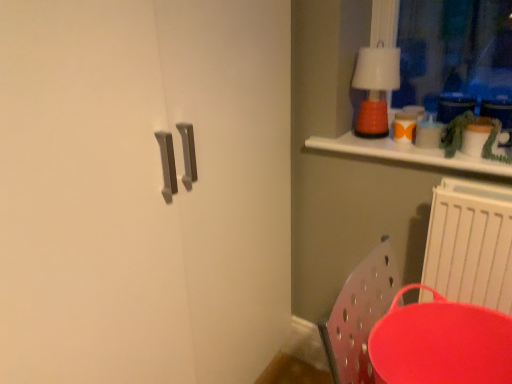
The height and width of the screenshot is (384, 512). Find the location of `matte red tray at lower right`. matte red tray at lower right is located at coordinates (441, 343).

The image size is (512, 384). What are the coordinates of `orange matte lamp at upper right` in the screenshot? It's located at (375, 88).

Image resolution: width=512 pixels, height=384 pixels. In order to click on white plastic radiator at lower right in this screenshot , I will do `click(470, 244)`.

Which of these two, white plastic radiator at lower right or matte red tray at lower right, is smaller?

white plastic radiator at lower right.

From a real-world perspective, is white plastic radiator at lower right located beneath matte red tray at lower right?

No, from a real-world perspective, white plastic radiator at lower right is not beneath matte red tray at lower right.

Is white plastic radiator at lower right placed right next to matte red tray at lower right?

No, white plastic radiator at lower right is not making contact with matte red tray at lower right.

From the image's perspective, is white plastic radiator at lower right located above matte red tray at lower right?

Yes, from the image's perspective, white plastic radiator at lower right is over matte red tray at lower right.

Which is closer, (430, 243) or (388, 51)?

The point (430, 243) is in front.

From the image's perspective, which object appears higher, white plastic radiator at lower right or orange matte lamp at upper right?

orange matte lamp at upper right, from the image's perspective.

Between white plastic radiator at lower right and orange matte lamp at upper right, which one appears on the right side from the viewer's perspective?

Positioned to the right is white plastic radiator at lower right.

From the picture: Is orange matte lamp at upper right looking in the opposite direction of white plastic radiator at lower right?

No.

Is orange matte lamp at upper right completely or partially outside of white plastic radiator at lower right?

Yes.

From their relative heights in the image, would you say orange matte lamp at upper right is taller or shorter than white plastic radiator at lower right?

In the image, orange matte lamp at upper right appears to be shorter than white plastic radiator at lower right.

The height and width of the screenshot is (384, 512). In order to click on lamp above the white plastic radiator at lower right (from a real-world perspective) in this screenshot , I will do `click(375, 88)`.

From the picture: Choose the correct answer: Is matte red tray at lower right inside white plastic radiator at lower right or outside it?

The correct answer is: outside.

From a real-world perspective, between matte red tray at lower right and white plastic radiator at lower right, who is vertically higher?

white plastic radiator at lower right is physically above.

Based on their positions, is matte red tray at lower right located to the left or right of white plastic radiator at lower right?

Clearly, matte red tray at lower right is on the left of white plastic radiator at lower right in the image.

Looking at this image, are matte red tray at lower right and white plastic radiator at lower right far apart?

matte red tray at lower right is near white plastic radiator at lower right, not far away.

The width and height of the screenshot is (512, 384). I want to click on round table that appears in front of the orange matte lamp at upper right, so click(441, 343).

From the picture: From the image's perspective, is matte red tray at lower right above orange matte lamp at upper right?

No.

Can orange matte lamp at upper right be found inside matte red tray at lower right?

That's incorrect, orange matte lamp at upper right is not inside matte red tray at lower right.

Is matte red tray at lower right at the left side of orange matte lamp at upper right?

Incorrect, matte red tray at lower right is not on the left side of orange matte lamp at upper right.

From a real-world perspective, is orange matte lamp at upper right physically located above or below matte red tray at lower right?

orange matte lamp at upper right is above matte red tray at lower right.

Between orange matte lamp at upper right and matte red tray at lower right, which one has smaller width?

orange matte lamp at upper right.

Who is bigger, orange matte lamp at upper right or matte red tray at lower right?

Bigger between the two is matte red tray at lower right.

From the image's perspective, does orange matte lamp at upper right appear lower than matte red tray at lower right?

No, from the image's perspective, orange matte lamp at upper right is not beneath matte red tray at lower right.

At what (x,y) coordinates should I click in order to perform the action: click on radiator on the right of matte red tray at lower right. Please return your answer as a coordinate pair (x, y). This screenshot has height=384, width=512. Looking at the image, I should click on (470, 244).

In the image, there is a orange matte lamp at upper right. At what (x,y) coordinates should I click in order to perform the action: click on radiator below it (from a real-world perspective). Please return your answer as a coordinate pair (x, y). The width and height of the screenshot is (512, 384). Looking at the image, I should click on (470, 244).

Considering their positions, is orange matte lamp at upper right positioned further to matte red tray at lower right than white plastic radiator at lower right?

orange matte lamp at upper right lies further to matte red tray at lower right than the other object.

In the scene shown: Estimate the real-world distances between objects in this image. Which object is further from white plastic radiator at lower right, orange matte lamp at upper right or matte red tray at lower right?

The object further to white plastic radiator at lower right is orange matte lamp at upper right.

Based on their spatial positions, is matte red tray at lower right or white plastic radiator at lower right further from orange matte lamp at upper right?

Based on the image, matte red tray at lower right appears to be further to orange matte lamp at upper right.

Based on their spatial positions, is matte red tray at lower right or orange matte lamp at upper right further from white plastic radiator at lower right?

orange matte lamp at upper right is further to white plastic radiator at lower right.

Which object lies further to the anchor point orange matte lamp at upper right, white plastic radiator at lower right or matte red tray at lower right?

The object further to orange matte lamp at upper right is matte red tray at lower right.

Considering their positions, is white plastic radiator at lower right positioned closer to matte red tray at lower right than orange matte lamp at upper right?

The object closer to matte red tray at lower right is white plastic radiator at lower right.

Image resolution: width=512 pixels, height=384 pixels. In order to click on radiator between orange matte lamp at upper right and matte red tray at lower right in the vertical direction in this screenshot , I will do `click(470, 244)`.